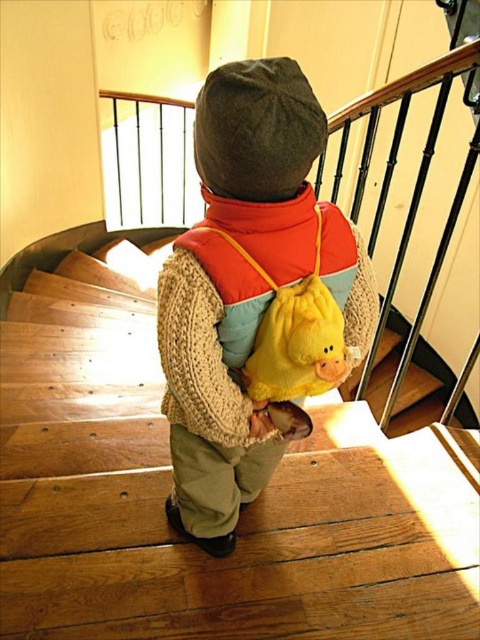
Which is above, knitted wool sweater at center or wooden at center?

knitted wool sweater at center

The image size is (480, 640). What are the coordinates of `knitted wool sweater at center` in the screenshot? It's located at (233, 285).

Who is higher up, wooden stairs at center or wooden at center?

wooden stairs at center is above.

This screenshot has height=640, width=480. In order to click on wooden stairs at center in this screenshot , I will do `click(240, 518)`.

Is point (230, 634) positioned before point (417, 388)?

Yes, point (230, 634) is in front of point (417, 388).

Where is `wooden stairs at center`? The image size is (480, 640). wooden stairs at center is located at coordinates (240, 518).

Between knitted wool sweater at center and yellow plush backpack at center, which one appears on the left side from the viewer's perspective?

knitted wool sweater at center

The height and width of the screenshot is (640, 480). Describe the element at coordinates (233, 285) in the screenshot. I see `knitted wool sweater at center` at that location.

Is point (300, 131) less distant than point (295, 352)?

Yes, point (300, 131) is in front of point (295, 352).

Identify the location of knitted wool sweater at center. The width and height of the screenshot is (480, 640). (233, 285).